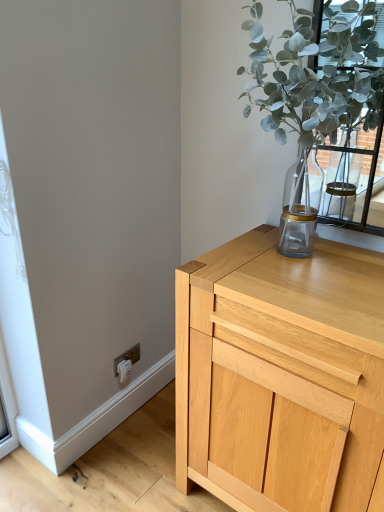
Question: Considering the relative positions of green leafy plant at upper right and white plastic electric outlet at lower left in the image provided, is green leafy plant at upper right in front of white plastic electric outlet at lower left?

Choices:
 (A) no
 (B) yes

Answer: (B)

Question: Is green leafy plant at upper right aimed at white plastic electric outlet at lower left?

Choices:
 (A) yes
 (B) no

Answer: (B)

Question: Does green leafy plant at upper right have a smaller size compared to white plastic electric outlet at lower left?

Choices:
 (A) no
 (B) yes

Answer: (A)

Question: Considering the relative sizes of green leafy plant at upper right and white plastic electric outlet at lower left in the image provided, is green leafy plant at upper right thinner than white plastic electric outlet at lower left?

Choices:
 (A) yes
 (B) no

Answer: (B)

Question: From the image's perspective, is green leafy plant at upper right under white plastic electric outlet at lower left?

Choices:
 (A) no
 (B) yes

Answer: (A)

Question: Looking at the image, does light wood cabinet at upper right seem bigger or smaller compared to white plastic electric outlet at lower left?

Choices:
 (A) small
 (B) big

Answer: (B)

Question: Considering the positions of light wood cabinet at upper right and white plastic electric outlet at lower left in the image, is light wood cabinet at upper right wider or thinner than white plastic electric outlet at lower left?

Choices:
 (A) wide
 (B) thin

Answer: (A)

Question: In the image, is light wood cabinet at upper right on the left side or the right side of white plastic electric outlet at lower left?

Choices:
 (A) left
 (B) right

Answer: (B)

Question: Considering the positions of point (355, 356) and point (135, 360), is point (355, 356) closer or farther from the camera than point (135, 360)?

Choices:
 (A) farther
 (B) closer

Answer: (B)

Question: From a real-world perspective, is green leafy plant at upper right physically located above or below light wood cabinet at upper right?

Choices:
 (A) above
 (B) below

Answer: (A)

Question: Is green leafy plant at upper right bigger or smaller than light wood cabinet at upper right?

Choices:
 (A) big
 (B) small

Answer: (B)

Question: In terms of height, does green leafy plant at upper right look taller or shorter compared to light wood cabinet at upper right?

Choices:
 (A) short
 (B) tall

Answer: (A)

Question: Do you think green leafy plant at upper right is within light wood cabinet at upper right, or outside of it?

Choices:
 (A) outside
 (B) inside

Answer: (A)

Question: In terms of height, does white plastic electric outlet at lower left look taller or shorter compared to green leafy plant at upper right?

Choices:
 (A) tall
 (B) short

Answer: (B)

Question: From a real-world perspective, relative to green leafy plant at upper right, is white plastic electric outlet at lower left vertically above or below?

Choices:
 (A) below
 (B) above

Answer: (A)